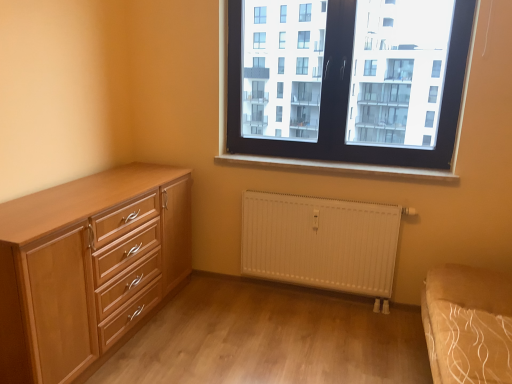
Where is `free space above white painted wood at center (from a real-world perspective)`? Image resolution: width=512 pixels, height=384 pixels. free space above white painted wood at center (from a real-world perspective) is located at coordinates (313, 159).